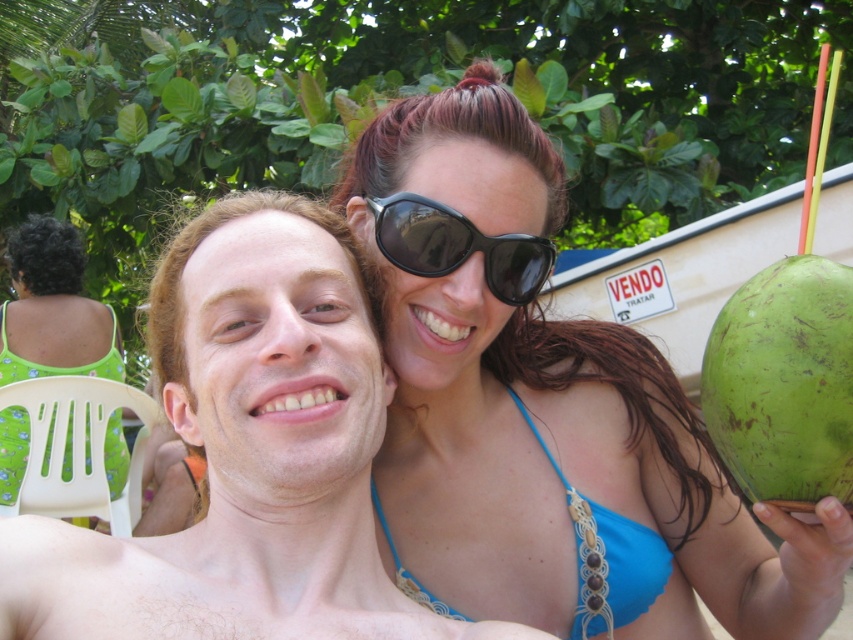
You are a photographer trying to capture the matte skin at center and the green rough coconut at right in a single frame. Based on their positions, which object is closer to the camera?

The matte skin at center is positioned under the green rough coconut at right, so the green rough coconut at right is closer to the camera.

You are planning to place a small decorative item between the green rough coconut at right and the green floral dress at upper left. Based on their heights, which object should you place the item closer to?

The green rough coconut at right is shorter than the green floral dress at upper left, so you should place the item closer to the green rough coconut at right to ensure it is visible above both.

You are a photographer trying to capture a candid shot of the two people in the scene. You want to ensure that both the matte skin at center and the blue macrame bikini top at upper right are clearly visible in the frame. Given their relative sizes, which object should you focus on first to ensure proper exposure?

The matte skin at center is much taller than the blue macrame bikini top at upper right, so focusing on the matte skin at center first will help ensure proper exposure since it occupies a larger portion of the frame.